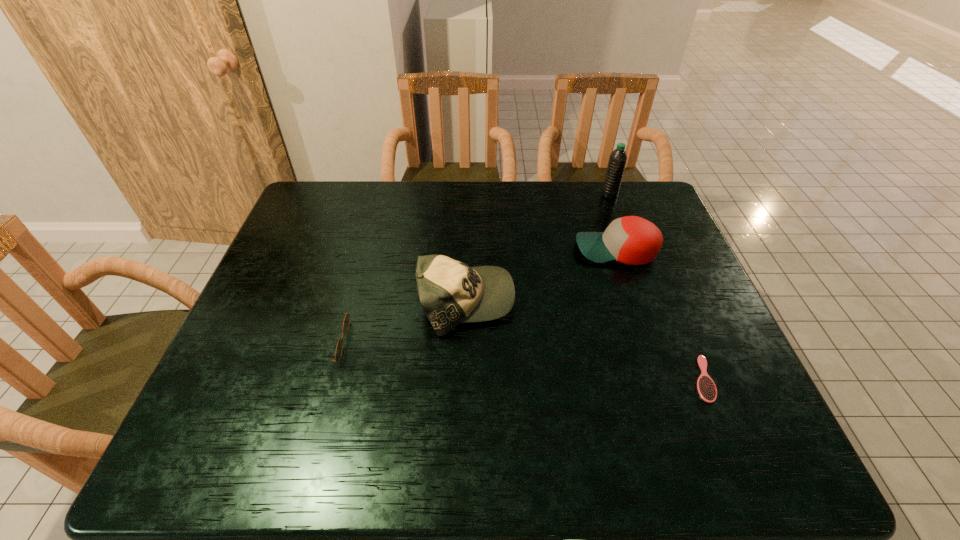
Where is `object at the far right corner`? object at the far right corner is located at coordinates (617, 161).

In the image, there is a desktop. Identify the location of vacant space at the far edge. (509, 221).

At what (x,y) coordinates should I click in order to perform the action: click on blank area at the right edge. Please return your answer as a coordinate pair (x, y). Looking at the image, I should click on (668, 327).

At what (x,y) coordinates should I click in order to perform the action: click on blank space at the far left corner of the desktop. Please return your answer as a coordinate pair (x, y). The image size is (960, 540). Looking at the image, I should click on (325, 219).

Identify the location of vacant area at the far right corner of the desktop. Image resolution: width=960 pixels, height=540 pixels. (668, 220).

You are a GUI agent. You are given a task and a screenshot of the screen. Output one action in this format:
    pyautogui.click(x=<x>, y=<y>)
    Task: Click on the vacant space at the near right corner
    The width and height of the screenshot is (960, 540).
    Given the screenshot: What is the action you would take?
    pyautogui.click(x=706, y=448)

Find the location of a particular element. Image resolution: width=960 pixels, height=540 pixels. empty space between the left baseball cap and the farthest object is located at coordinates (538, 248).

Locate an element on the screen. free space between the shortest object and the sunglasses is located at coordinates (514, 360).

Locate an element on the screen. This screenshot has width=960, height=540. vacant space that is in between the shortest object and the fourth nearest object is located at coordinates (660, 314).

Choose which object is the fourth nearest neighbor to the leftmost object. Please provide its 2D coordinates. Your answer should be formatted as a tuple, i.e. [(x, y)], where the tuple contains the x and y coordinates of a point satisfying the conditions above.

[(617, 161)]